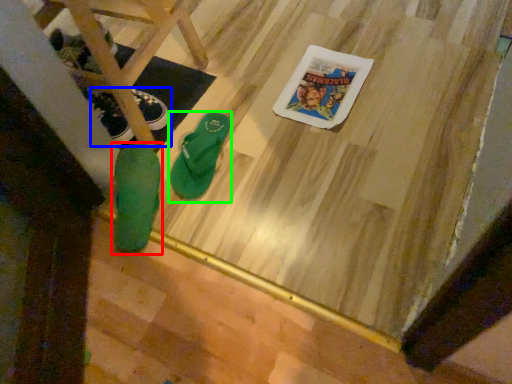
Question: Which object is positioned farthest from footwear (highlighted by a red box)? Select from footwear (highlighted by a blue box) and footwear (highlighted by a green box).

Choices:
 (A) footwear
 (B) footwear

Answer: (A)